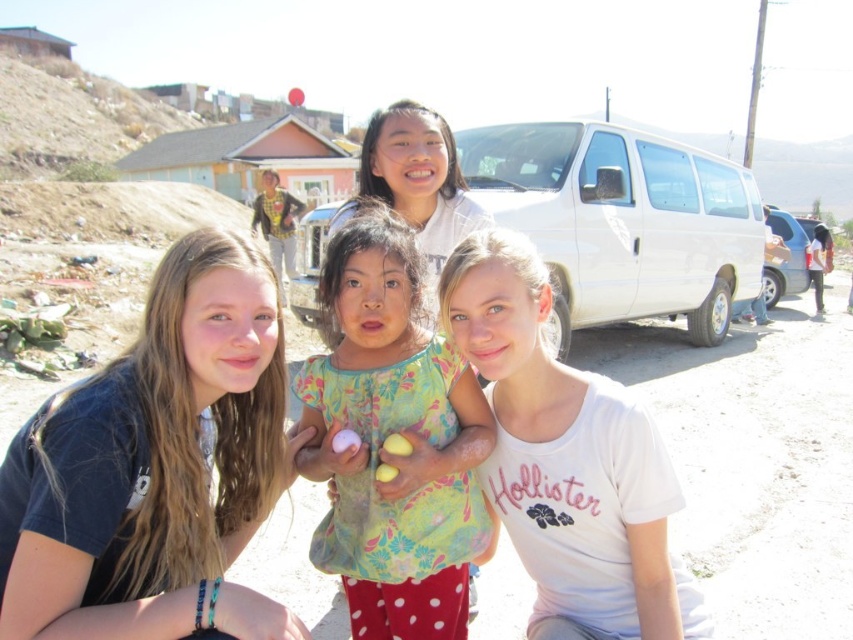
Question: Among these objects, which one is farthest from the camera?

Choices:
 (A) floral fabric dress at center
 (B) matte blue shirt at center

Answer: (A)

Question: Does floral fabric dress at center have a smaller size compared to matte white shirt at center?

Choices:
 (A) no
 (B) yes

Answer: (A)

Question: Does matte blue shirt at center appear over floral fabric dress at center?

Choices:
 (A) yes
 (B) no

Answer: (B)

Question: Which object appears farthest from the camera in this image?

Choices:
 (A) matte white shirt at center
 (B) floral fabric dress at center
 (C) matte blue shirt at center

Answer: (A)

Question: Is matte blue shirt at center to the left of matte white shirt at center from the viewer's perspective?

Choices:
 (A) yes
 (B) no

Answer: (A)

Question: Which point is closer to the camera taking this photo?

Choices:
 (A) (54, 504)
 (B) (440, 189)

Answer: (A)